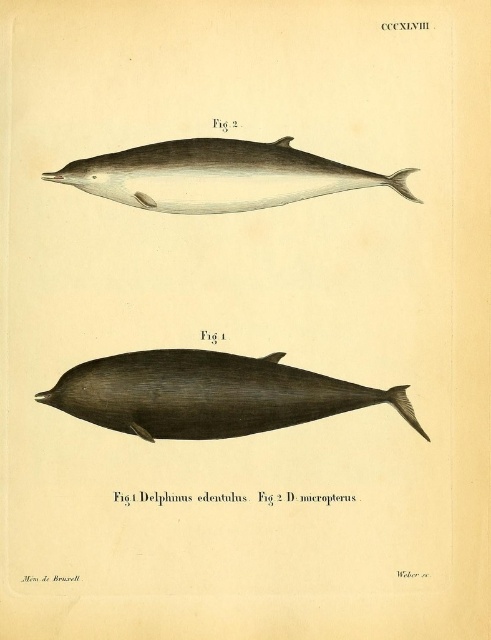
In the scientific illustration, there are two dolphins labeled as dark gray smooth dolphin at bottom and smooth gray dolphin at upper center. Which dolphin has a greater width?

The dark gray smooth dolphin at bottom has a greater width than the smooth gray dolphin at upper center according to the illustration.

Based on the illustration, which dolphin is taller when comparing the dark gray smooth dolphin at bottom and the smooth gray dolphin at upper center?

The dark gray smooth dolphin at bottom is much taller than the smooth gray dolphin at upper center according to the illustration.

From the picture: You are an art conservator examining the illustration of the two dolphins. You notice two points marked in the image at coordinates point (291, 408) and point (336, 170). Which of these points is closer to the viewer?

Point (291, 408) is further to the viewer than point (336, 170), so point (291, 408) is closer to the viewer.